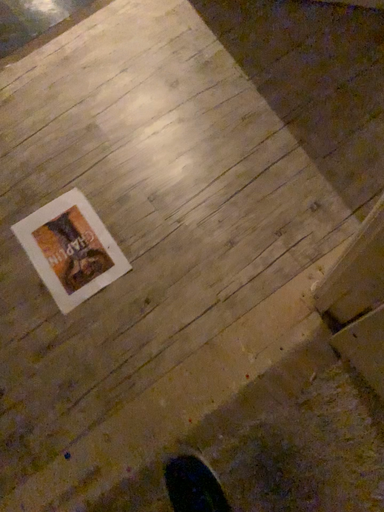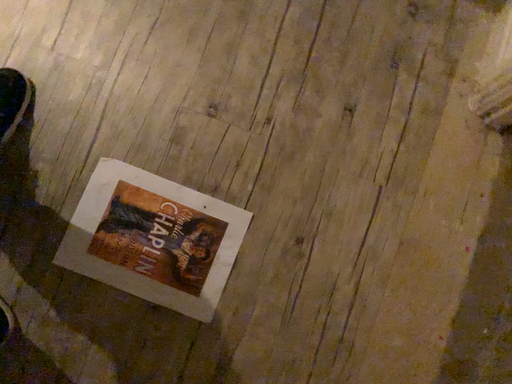
Question: How did the camera likely rotate when shooting the video?

Choices:
 (A) rotated right
 (B) rotated left

Answer: (A)